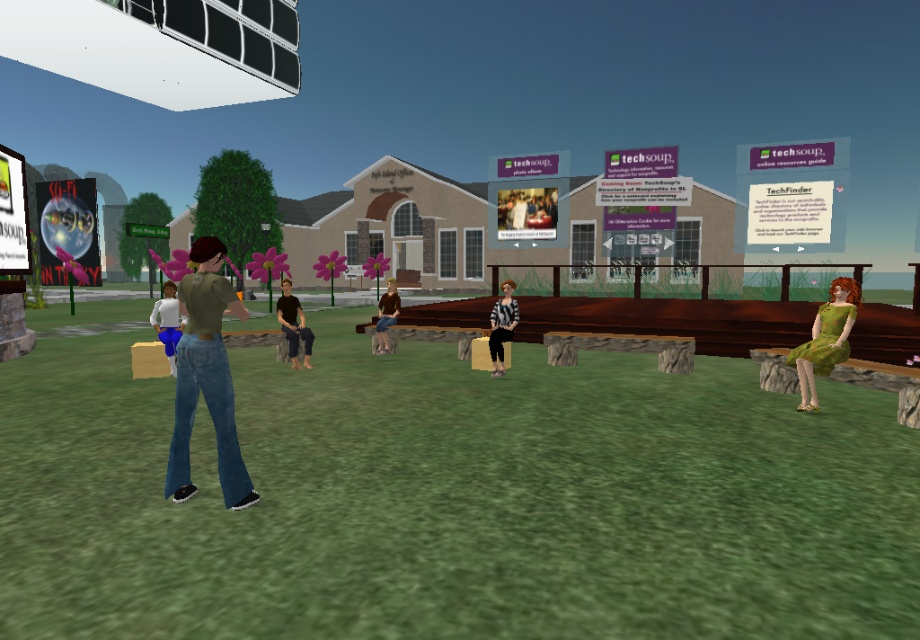
You are standing in the outdoor area of a TechSoup event and see two people wearing the denim jeans at center and the green fabric dress at lower right. Which person is closer to you?

The denim jeans at center is closer to the viewer than the green fabric dress at lower right, so the person wearing denim jeans at center is closer to you.

Looking at this image, you are a photographer setting up a shoot in this public space. You notice two subjects wearing the denim jeans at center and the white matte shirt at center. Which clothing item is positioned lower on their body?

The denim jeans at center is below the white matte shirt at center, so the denim jeans at center is positioned lower on their body.

You are standing at the entrance of the TechSoup building and see two people wearing denim jeans at center and white matte shirt at center. You need to approach them to ask for directions. Which one is closer to you?

The denim jeans at center is 18.73 feet away from the white matte shirt at center, so the white matte shirt at center is closer to you since it is only 18.73 feet away from the denim jeans at center and you are at the entrance which is further away.